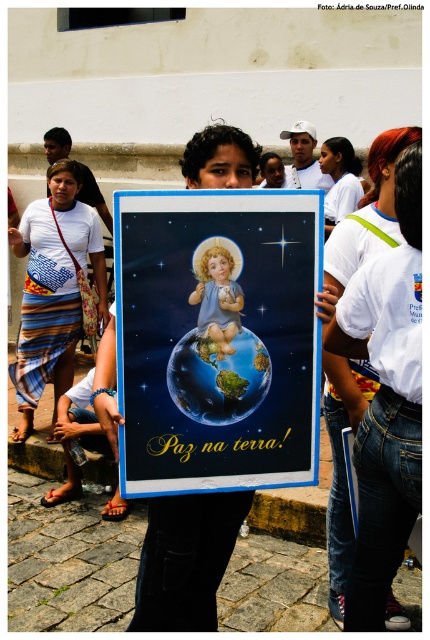
Question: Does earth-like globe at center appear on the right side of white fabric shirt at upper center?

Choices:
 (A) no
 (B) yes

Answer: (A)

Question: Which of the following is the closest to the observer?

Choices:
 (A) white fabric shirt at center
 (B) striped fabric skirt at center
 (C) smooth porcelain baby at center

Answer: (A)

Question: Which point is farther to the camera?

Choices:
 (A) (190, 390)
 (B) (226, 310)
 (C) (263, 202)
 (D) (356, 163)

Answer: (D)

Question: Does white fabric shirt at center appear on the left side of white fabric shirt at upper center?

Choices:
 (A) no
 (B) yes

Answer: (B)

Question: Observing the image, what is the correct spatial positioning of matte plastic poster at center in reference to striped fabric skirt at center?

Choices:
 (A) below
 (B) above

Answer: (A)

Question: Which point is closer to the camera?

Choices:
 (A) earth-like globe at center
 (B) white fabric shirt at upper center
 (C) striped fabric skirt at center

Answer: (A)